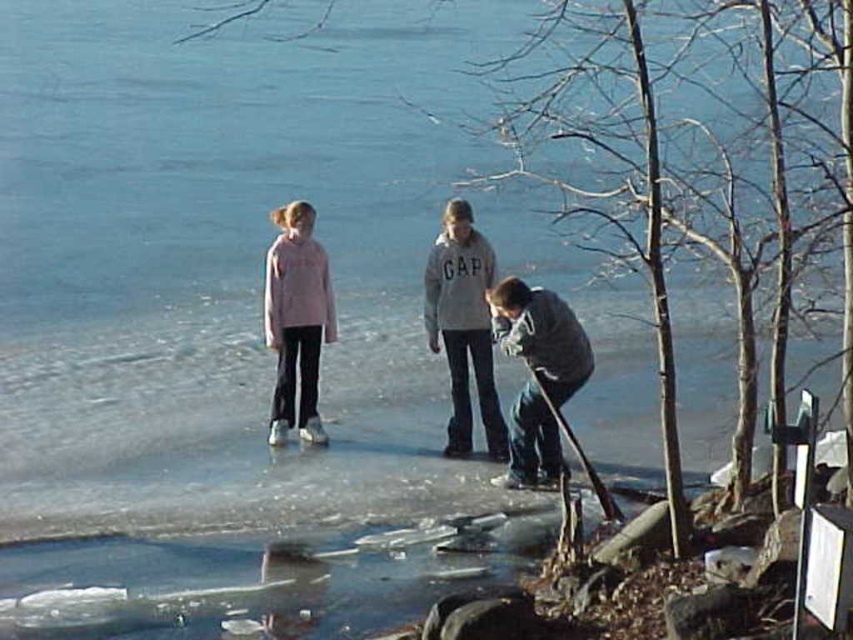
Question: Is gray cotton hoodie at center bigger than gray wool sweater at lower center?

Choices:
 (A) yes
 (B) no

Answer: (A)

Question: Which point appears closest to the camera in this image?

Choices:
 (A) (523, 419)
 (B) (289, 362)

Answer: (A)

Question: Which point is closer to the camera?

Choices:
 (A) (305, 268)
 (B) (543, 454)
 (C) (477, 326)

Answer: (B)

Question: Considering the relative positions of gray cotton hoodie at center and gray wool sweater at lower center in the image provided, where is gray cotton hoodie at center located with respect to gray wool sweater at lower center?

Choices:
 (A) left
 (B) right

Answer: (A)

Question: Considering the real-world distances, which object is farthest from the pink fleece jacket at center?

Choices:
 (A) gray wool sweater at lower center
 (B) gray cotton hoodie at center

Answer: (A)

Question: Considering the relative positions of gray cotton hoodie at center and gray wool sweater at lower center in the image provided, where is gray cotton hoodie at center located with respect to gray wool sweater at lower center?

Choices:
 (A) above
 (B) below

Answer: (A)